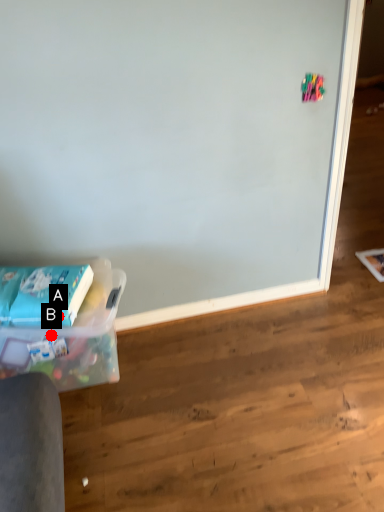
Question: Two points are circled on the image, labeled by A and B beside each circle. Which point is closer to the camera taking this photo?

Choices:
 (A) A is closer
 (B) B is closer

Answer: (A)